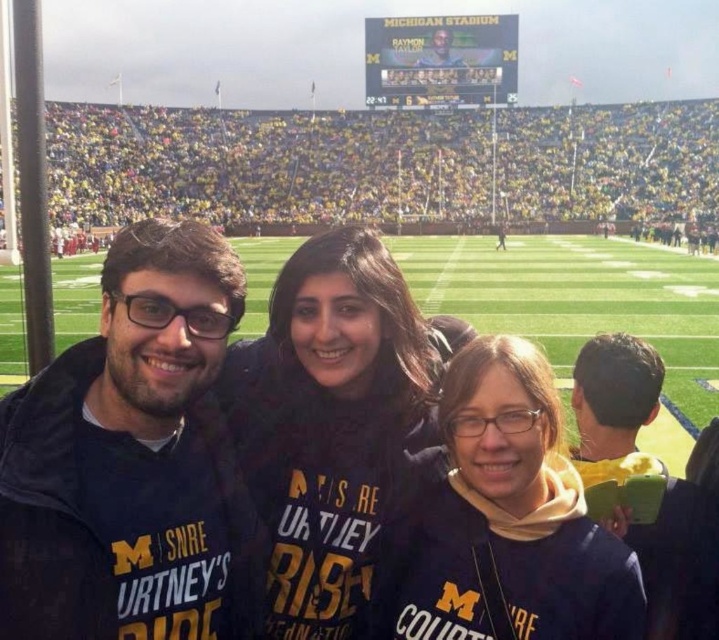
Does dark blue fabric at center lie in front of dark blue jacket at right?

Yes.

Does dark blue fabric at center have a greater height compared to dark blue jacket at right?

Yes, dark blue fabric at center is taller than dark blue jacket at right.

Is point (155, 243) closer to viewer compared to point (709, 481)?

Yes, it is.

You are a GUI agent. You are given a task and a screenshot of the screen. Output one action in this format:
    pyautogui.click(x=<x>, y=<y>)
    Task: Click on the dark blue fabric at center
    
    Given the screenshot: What is the action you would take?
    pyautogui.click(x=132, y=460)